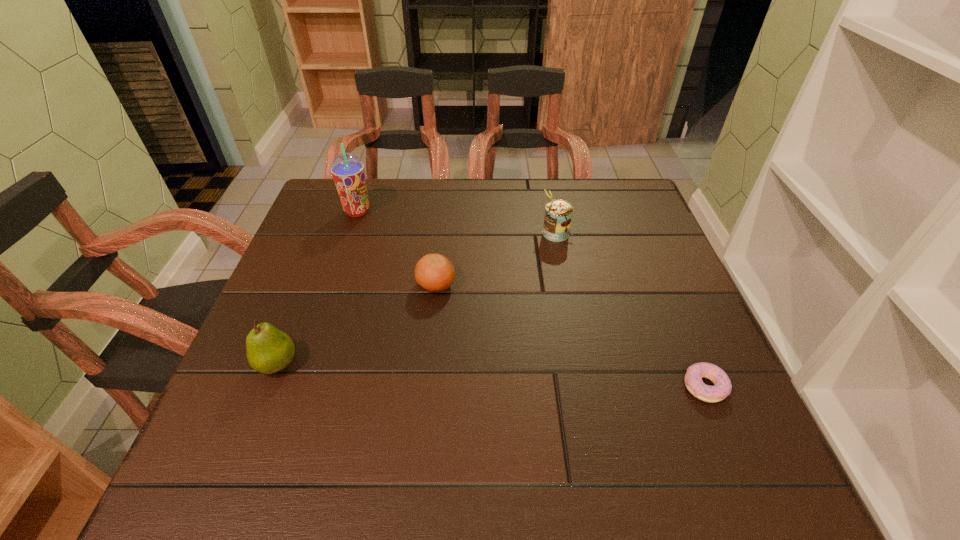
The image size is (960, 540). I want to click on free point between the fourth tallest object and the tallest object, so click(x=396, y=248).

At what (x,y) coordinates should I click in order to perform the action: click on vacant area that lies between the can and the pear. Please return your answer as a coordinate pair (x, y). This screenshot has width=960, height=540. Looking at the image, I should click on (417, 299).

Locate an element on the screen. The image size is (960, 540). free space that is in between the third object from left to right and the tallest object is located at coordinates (396, 248).

The image size is (960, 540). I want to click on unoccupied position between the tallest object and the second farthest object, so click(457, 222).

Find the location of `free space that is in between the pear and the smoothie`. free space that is in between the pear and the smoothie is located at coordinates (318, 288).

Select which object appears as the closest to the pear. Please provide its 2D coordinates. Your answer should be formatted as a tuple, i.e. [(x, y)], where the tuple contains the x and y coordinates of a point satisfying the conditions above.

[(434, 272)]

Identify the location of object that can be found as the fourth closest to the farthest object. The width and height of the screenshot is (960, 540). (722, 387).

I want to click on free region that satisfies the following two spatial constraints: 1. on the back side of the clementine; 2. on the right side of the pear, so click(309, 285).